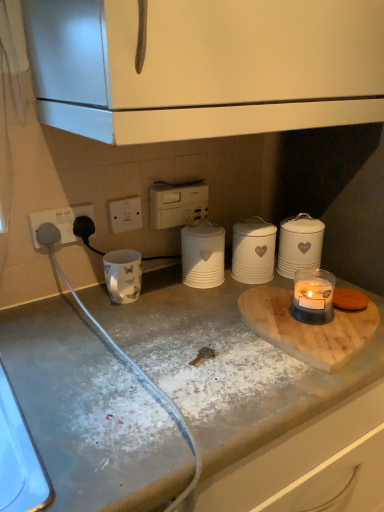
Locate an element on the screen. free space that is to the left of translucent glass candle at lower right is located at coordinates (206, 323).